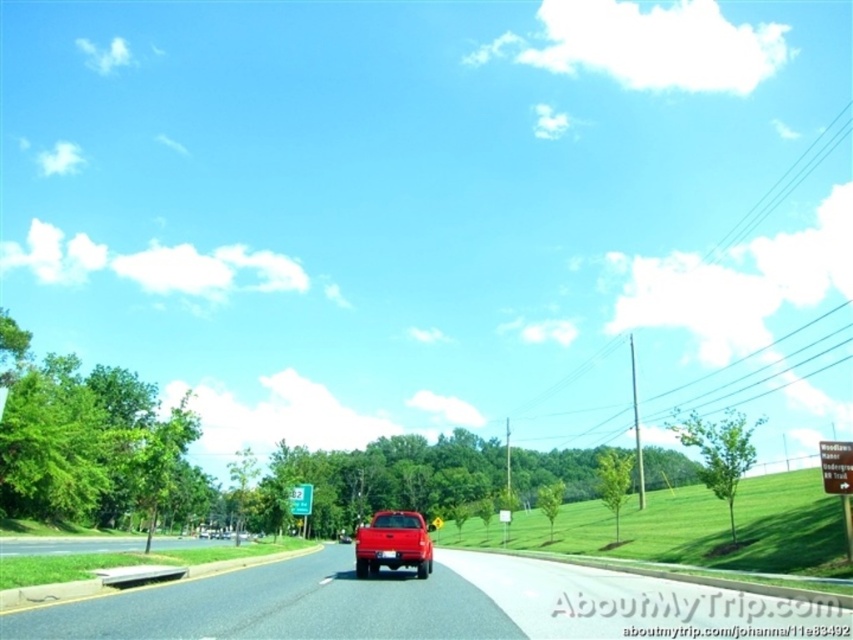
Question: Considering the relative positions of matte red truck at center and green plastic sign at center in the image provided, where is matte red truck at center located with respect to green plastic sign at center?

Choices:
 (A) right
 (B) left

Answer: (A)

Question: Considering the real-world distances, which object is closest to the gray asphalt road at lower left?

Choices:
 (A) glossy red truck at center
 (B) matte red truck at center
 (C) green plastic sign at center

Answer: (C)

Question: Which of the following is the farthest from the observer?

Choices:
 (A) glossy red truck at center
 (B) gray asphalt road at lower left
 (C) green plastic sign at center

Answer: (C)

Question: Which point appears closest to the camera in this image?

Choices:
 (A) tap(167, 538)
 (B) tap(136, 598)
 (C) tap(422, 566)

Answer: (B)

Question: Is matte red truck at center thinner than gray asphalt road at lower left?

Choices:
 (A) no
 (B) yes

Answer: (B)

Question: Observing the image, what is the correct spatial positioning of glossy red truck at center in reference to green plastic sign at center?

Choices:
 (A) below
 (B) above

Answer: (B)